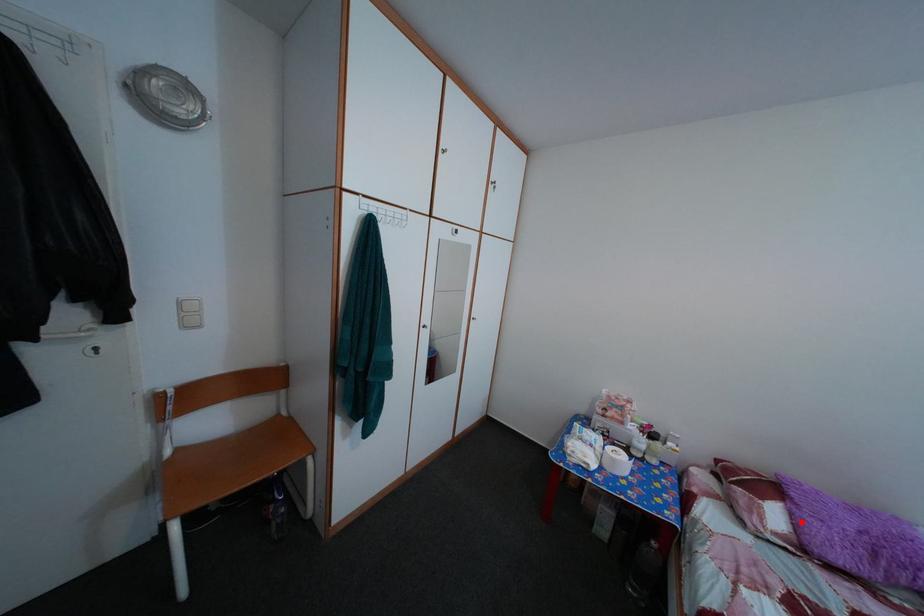
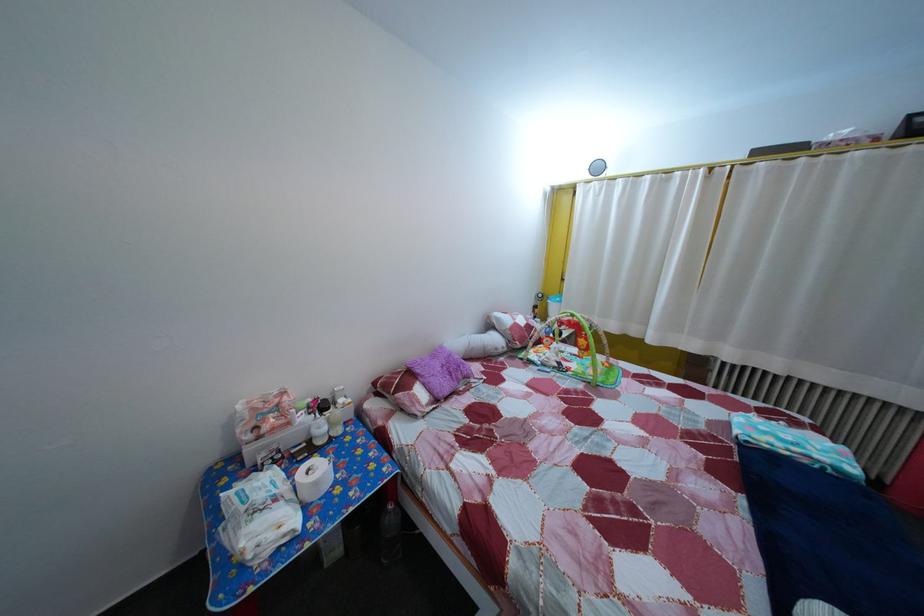
Find the pixel in the second image that matches the highlighted location in the first image.

(433, 392)